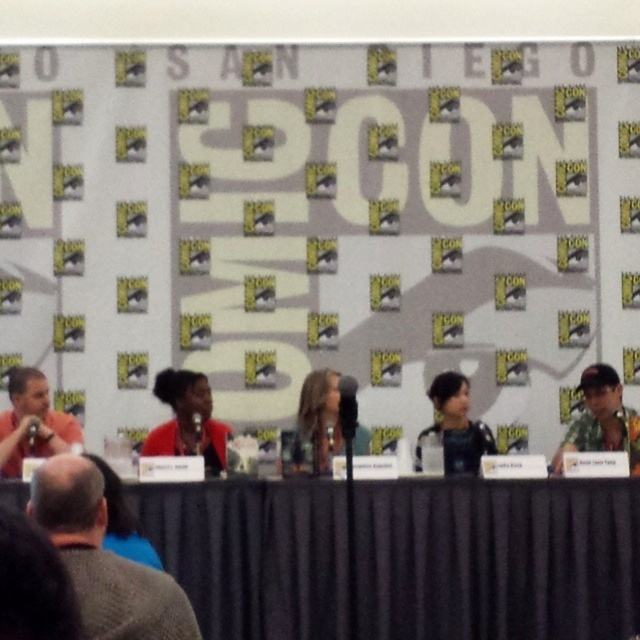
Question: Which object is the closest to the matte red jacket at center?

Choices:
 (A) smooth brown hair at center
 (B) camouflage fabric cap at upper right
 (C) black matte jacket at center

Answer: (A)

Question: Does gray wool sweater at lower left appear under matte orange shirt at left?

Choices:
 (A) yes
 (B) no

Answer: (A)

Question: Which of the following is the closest to the observer?

Choices:
 (A) black matte jacket at center
 (B) gray wool sweater at lower left

Answer: (B)

Question: Which of the following is the closest to the observer?

Choices:
 (A) black fabric table at lower center
 (B) gray wool sweater at lower left

Answer: (B)

Question: Does matte red jacket at center have a smaller size compared to black matte jacket at center?

Choices:
 (A) yes
 (B) no

Answer: (B)

Question: Is gray wool sweater at lower left wider than black matte jacket at center?

Choices:
 (A) no
 (B) yes

Answer: (B)